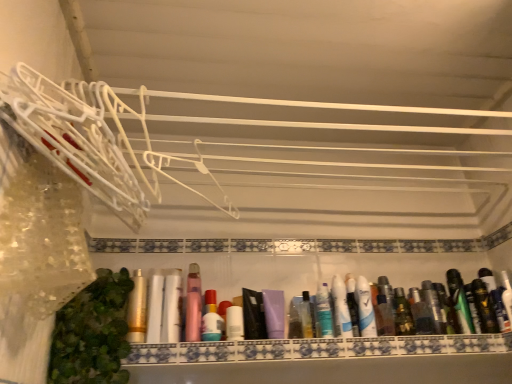
Question: Does point (385, 288) appear closer or farther from the camera than point (449, 273)?

Choices:
 (A) farther
 (B) closer

Answer: (A)

Question: In the image, is shiny metallic spray can at center, which is counted as the 9th toiletry, starting from the right, on the left side or the right side of green matte deodorant at right, marked as the fourteenth toiletry in a left-to-right arrangement?

Choices:
 (A) right
 (B) left

Answer: (B)

Question: Which of these objects is positioned closest to the matte white tube at center, positioned as the fifteenth toiletry in right-to-left order?

Choices:
 (A) pink matte bottle at center, the fourteenth toiletry from the right
 (B) white matte lotion at center, which ranks as the seventh toiletry in left-to-right order
 (C) shiny metallic spray can at center, which is counted as the 9th toiletry, starting from the right
 (D) matte gold tube at center, marked as the 16th toiletry in a right-to-left arrangement
 (E) green leafy plant at lower left

Answer: (D)

Question: Which is nearer to the translucent plastic spray can at center, acting as the tenth toiletry starting from the right?

Choices:
 (A) green matte deodorant at right, marked as the fourteenth toiletry in a left-to-right arrangement
 (B) white matte lotion at center, placed as the eleventh toiletry when sorted from right to left
 (C) matte black deodorant at center right, the 16th toiletry in the left-to-right sequence
 (D) matte gold tube at center, marked as the 16th toiletry in a right-to-left arrangement
 (E) metallic silver spray can at right, placed as the eleventh toiletry when sorted from left to right

Answer: (B)